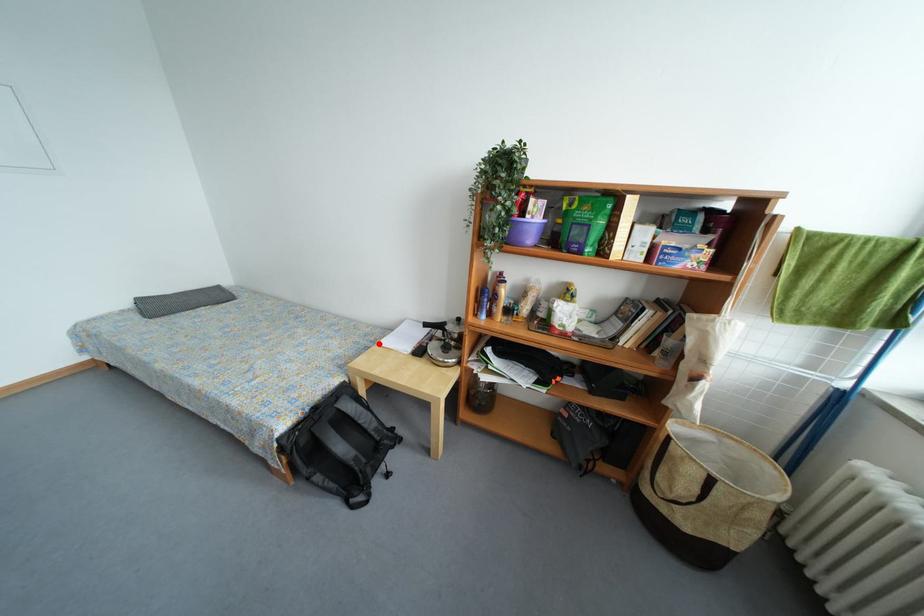
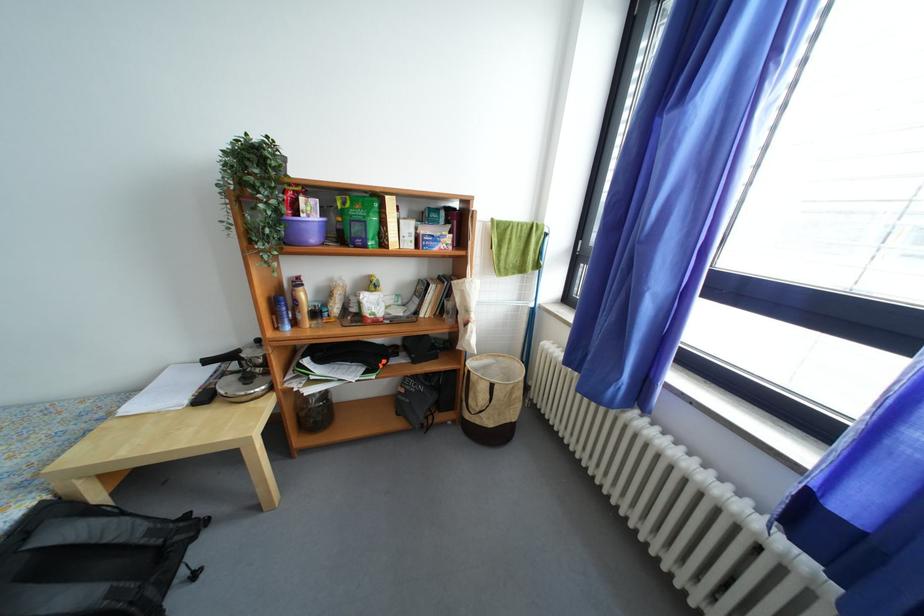
Find the pixel in the second image that matches the highlighted location in the first image.

(106, 419)